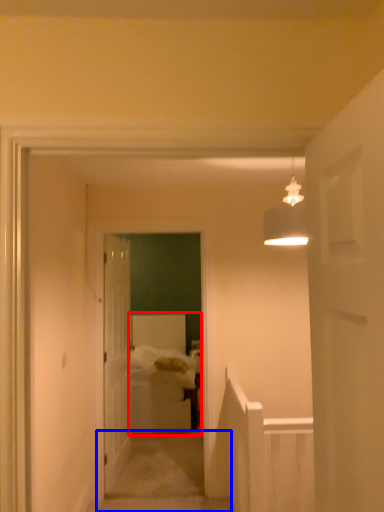
Question: Which object appears farthest to the camera in this image, bed (highlighted by a red box) or path (highlighted by a blue box)?

Choices:
 (A) bed
 (B) path

Answer: (A)